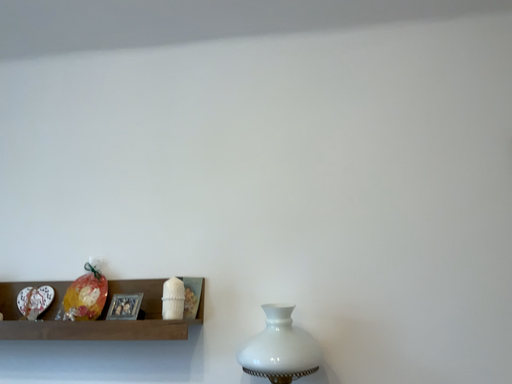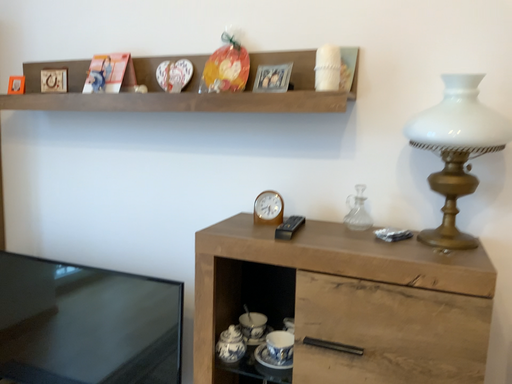
Question: How did the camera likely rotate when shooting the video?

Choices:
 (A) rotated upward
 (B) rotated downward

Answer: (B)